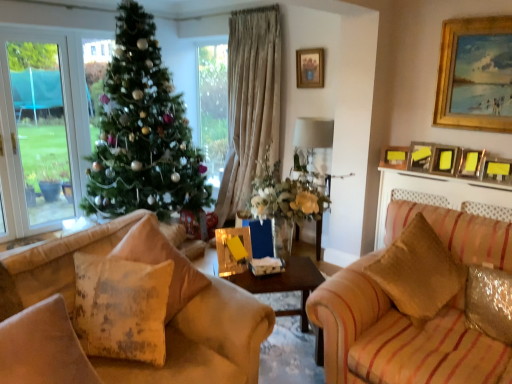
The width and height of the screenshot is (512, 384). I want to click on shiny metallic pillow at lower right, the first pillow from the right, so click(x=489, y=302).

The width and height of the screenshot is (512, 384). Describe the element at coordinates (285, 284) in the screenshot. I see `wooden table at center` at that location.

You are a GUI agent. You are given a task and a screenshot of the screen. Output one action in this format:
    pyautogui.click(x=<x>, y=<y>)
    Task: Click on the wooden table at center
    The width and height of the screenshot is (512, 384).
    Given the screenshot: What is the action you would take?
    pyautogui.click(x=285, y=284)

What do you see at coordinates (310, 68) in the screenshot? The image size is (512, 384). I see `gold-framed picture at upper center, the 7th picture frame in the right-to-left sequence` at bounding box center [310, 68].

This screenshot has width=512, height=384. What do you see at coordinates (162, 261) in the screenshot?
I see `fluffy beige pillow at center, the second pillow when ordered from right to left` at bounding box center [162, 261].

Identify the location of fluffy beige pillow at center, the second pillow when ordered from right to left. The height and width of the screenshot is (384, 512). click(162, 261).

The image size is (512, 384). Identify the location of gold wooden picture frame at upper right, the sixth picture frame positioned from the left. (475, 74).

Considering the positions of point (262, 286) and point (302, 84), is point (262, 286) closer or farther from the camera than point (302, 84)?

Point (262, 286) is positioned closer to the camera compared to point (302, 84).

Considering the sizes of objects wooden table at center and gold-framed picture at upper center, the 1th picture frame from the left, in the image provided, who is shorter, wooden table at center or gold-framed picture at upper center, the 1th picture frame from the left,?

With less height is gold-framed picture at upper center, the 1th picture frame from the left.

From the picture: Is wooden table at center oriented towards gold-framed picture at upper center, the 7th picture frame in the right-to-left sequence?

No, wooden table at center does not turn towards gold-framed picture at upper center, the 7th picture frame in the right-to-left sequence.

At what (x,y) coordinates should I click in order to perform the action: click on table that appears below the gold-framed picture at upper center, the 7th picture frame in the right-to-left sequence (from the image's perspective). Please return your answer as a coordinate pair (x, y). Image resolution: width=512 pixels, height=384 pixels. Looking at the image, I should click on (285, 284).

Between yellow matte picture frame at upper right, which is counted as the fourth picture frame, starting from the left, and metallic gold picture frame at upper right, positioned as the seventh picture frame in left-to-right order, which one is positioned behind?

yellow matte picture frame at upper right, which is counted as the fourth picture frame, starting from the left, is further away from the camera.

Based on their sizes in the image, would you say yellow matte picture frame at upper right, which is the fourth picture frame in right-to-left order, is bigger or smaller than metallic gold picture frame at upper right, positioned as the seventh picture frame in left-to-right order?

In the image, yellow matte picture frame at upper right, which is the fourth picture frame in right-to-left order, appears to be larger than metallic gold picture frame at upper right, positioned as the seventh picture frame in left-to-right order.

Is yellow matte picture frame at upper right, which is counted as the fourth picture frame, starting from the left, at the right side of metallic gold picture frame at upper right, positioned as the first picture frame in right-to-left order?

No.

Which object is thinner, yellow matte picture frame at upper right, which is the fourth picture frame in right-to-left order, or metallic gold picture frame at upper right, positioned as the first picture frame in right-to-left order?

Thinner between the two is metallic gold picture frame at upper right, positioned as the first picture frame in right-to-left order.

From the picture: From a real-world perspective, is metallic gold picture frame at upper right, arranged as the 3th picture frame when viewed from the right, physically below wooden table at center?

No, from a real-world perspective, metallic gold picture frame at upper right, arranged as the 3th picture frame when viewed from the right, is not below wooden table at center.

Between metallic gold picture frame at upper right, arranged as the 3th picture frame when viewed from the right, and wooden table at center, which one has more height?

With more height is wooden table at center.

Which object is positioned more to the left, metallic gold picture frame at upper right, acting as the fifth picture frame starting from the left, or wooden table at center?

wooden table at center is more to the left.

Does point (467, 172) appear closer or farther from the camera than point (274, 274)?

Point (467, 172) appears to be farther away from the viewer than point (274, 274).

Who is bigger, gold wooden picture frame at upper right, which appears as the second picture frame when viewed from the right, or shiny metallic pillow at lower right, the first pillow from the right?

gold wooden picture frame at upper right, which appears as the second picture frame when viewed from the right, is bigger.

Is gold wooden picture frame at upper right, the sixth picture frame positioned from the left, not within shiny metallic pillow at lower right, the first pillow from the right?

That's correct, gold wooden picture frame at upper right, the sixth picture frame positioned from the left, is outside of shiny metallic pillow at lower right, the first pillow from the right.

Which pillow is the 1st one when counting from the front of the gold wooden picture frame at upper right, the sixth picture frame positioned from the left? Please provide its 2D coordinates.

[(489, 302)]

Are gold wooden picture frame at upper right, which appears as the second picture frame when viewed from the right, and shiny metallic pillow at lower right, the first pillow from the right, located far from each other?

Yes, gold wooden picture frame at upper right, which appears as the second picture frame when viewed from the right, and shiny metallic pillow at lower right, the first pillow from the right, are located far from each other.

From a real-world perspective, is gold-framed picture at upper center, the 1th picture frame from the left, located beneath fluffy beige pillow at center, the 3th pillow positioned from the left?

No, from a real-world perspective, gold-framed picture at upper center, the 1th picture frame from the left, is not beneath fluffy beige pillow at center, the 3th pillow positioned from the left.

Considering the relative sizes of gold-framed picture at upper center, the 1th picture frame from the left, and fluffy beige pillow at center, the second pillow when ordered from right to left, in the image provided, is gold-framed picture at upper center, the 1th picture frame from the left, taller than fluffy beige pillow at center, the second pillow when ordered from right to left,?

Incorrect, the height of gold-framed picture at upper center, the 1th picture frame from the left, is not larger of that of fluffy beige pillow at center, the second pillow when ordered from right to left.

Does point (310, 53) come farther from viewer compared to point (136, 233)?

Yes.

Is gold-framed picture at upper center, the 1th picture frame from the left, at the left side of fluffy beige pillow at center, the 3th pillow positioned from the left?

No, gold-framed picture at upper center, the 1th picture frame from the left, is not to the left of fluffy beige pillow at center, the 3th pillow positioned from the left.

From the image's perspective, which is above, metallic gold picture frame at upper right, arranged as the 3th picture frame when viewed from the right, or yellow matte picture frame at upper right, which is counted as the fourth picture frame, starting from the left?

yellow matte picture frame at upper right, which is counted as the fourth picture frame, starting from the left.

Is metallic gold picture frame at upper right, acting as the fifth picture frame starting from the left, closer to the viewer compared to yellow matte picture frame at upper right, which is the fourth picture frame in right-to-left order?

Yes, metallic gold picture frame at upper right, acting as the fifth picture frame starting from the left, is closer to the camera.

Is point (471, 152) positioned behind point (457, 148)?

No, (471, 152) is closer to viewer.

In terms of height, does metallic gold picture frame at upper right, arranged as the 3th picture frame when viewed from the right, look taller or shorter compared to yellow matte picture frame at upper right, which is counted as the fourth picture frame, starting from the left?

Considering their sizes, metallic gold picture frame at upper right, arranged as the 3th picture frame when viewed from the right, has less height than yellow matte picture frame at upper right, which is counted as the fourth picture frame, starting from the left.

Find the location of a particular element. The height and width of the screenshot is (384, 512). pillow that is the 1st object directly below the metallic gold picture frame at upper right, positioned as the seventh picture frame in left-to-right order (from a real-world perspective) is located at coordinates (162, 261).

From the image's perspective, which one is positioned lower, fluffy beige pillow at center, the second pillow when ordered from right to left, or metallic gold picture frame at upper right, positioned as the first picture frame in right-to-left order?

fluffy beige pillow at center, the second pillow when ordered from right to left.

Is fluffy beige pillow at center, the 3th pillow positioned from the left, positioned before metallic gold picture frame at upper right, positioned as the first picture frame in right-to-left order?

Yes, fluffy beige pillow at center, the 3th pillow positioned from the left, is closer to the viewer.

This screenshot has width=512, height=384. In order to click on the 7th picture frame positioned above the wooden table at center (from a real-world perspective) in this screenshot , I will do `click(310, 68)`.

The image size is (512, 384). Find the location of `the 3rd picture frame to the left when counting from the metallic gold picture frame at upper right, positioned as the seventh picture frame in left-to-right order`. the 3rd picture frame to the left when counting from the metallic gold picture frame at upper right, positioned as the seventh picture frame in left-to-right order is located at coordinates (445, 160).

Based on the photo, which object lies nearer to the anchor point metallic gold picture frame at upper right, positioned as the seventh picture frame in left-to-right order, metallic silver picture frame at upper right, marked as the 3th picture frame in a left-to-right arrangement, or distressed yellow pillow at lower left, arranged as the second pillow when viewed from the left?

metallic silver picture frame at upper right, marked as the 3th picture frame in a left-to-right arrangement, is closer to metallic gold picture frame at upper right, positioned as the seventh picture frame in left-to-right order.

Which object lies nearer to the anchor point metallic gold picture frame at upper right, positioned as the seventh picture frame in left-to-right order, metallic silver picture frame at upper right, marked as the 3th picture frame in a left-to-right arrangement, or striped fabric couch at right?

metallic silver picture frame at upper right, marked as the 3th picture frame in a left-to-right arrangement, lies closer to metallic gold picture frame at upper right, positioned as the seventh picture frame in left-to-right order, than the other object.

Which object lies further to the anchor point distressed yellow pillow at lower left, arranged as the second pillow when viewed from the left, wooden table at center or yellow matte picture frame at upper right, which is the fourth picture frame in right-to-left order?

Among the two, yellow matte picture frame at upper right, which is the fourth picture frame in right-to-left order, is located further to distressed yellow pillow at lower left, arranged as the second pillow when viewed from the left.

Which object lies nearer to the anchor point gold wooden picture frame at upper right, which appears as the second picture frame when viewed from the right, wooden table at center or gold-framed picture at upper center, the 7th picture frame in the right-to-left sequence?

gold-framed picture at upper center, the 7th picture frame in the right-to-left sequence, is closer to gold wooden picture frame at upper right, which appears as the second picture frame when viewed from the right.

Which object lies further to the anchor point green matte christmas tree at center, gold wooden picture frame at upper right, the sixth picture frame positioned from the left, or matte gold picture frame at upper right, placed as the sixth picture frame when sorted from right to left?

The object further to green matte christmas tree at center is gold wooden picture frame at upper right, the sixth picture frame positioned from the left.

When comparing their distances from metallic gold picture frame at upper right, positioned as the seventh picture frame in left-to-right order, does striped fabric couch at right or gold-framed picture at upper center, the 7th picture frame in the right-to-left sequence, seem further?

gold-framed picture at upper center, the 7th picture frame in the right-to-left sequence.

From the image, which object appears to be farther from metallic gold picture frame at upper right, acting as the fifth picture frame starting from the left, striped fabric couch at right or fluffy beige pillow at center, the second pillow when ordered from right to left?

Based on the image, fluffy beige pillow at center, the second pillow when ordered from right to left, appears to be further to metallic gold picture frame at upper right, acting as the fifth picture frame starting from the left.

Based on their spatial positions, is gold-framed picture at upper center, the 1th picture frame from the left, or green matte christmas tree at center closer to distressed yellow pillow at lower left, which is the third pillow from right to left?

Based on the image, green matte christmas tree at center appears to be nearer to distressed yellow pillow at lower left, which is the third pillow from right to left.

Where is `studio couch located between shiny metallic pillow at lower right, the first pillow from the right, and metallic gold picture frame at upper right, positioned as the seventh picture frame in left-to-right order, in the depth direction`? The width and height of the screenshot is (512, 384). studio couch located between shiny metallic pillow at lower right, the first pillow from the right, and metallic gold picture frame at upper right, positioned as the seventh picture frame in left-to-right order, in the depth direction is located at coordinates (395, 337).

Where is `studio couch located between fluffy beige pillow at center, the second pillow when ordered from right to left, and shiny metallic pillow at lower right, the fourth pillow when ordered from left to right, in the left-right direction`? The image size is (512, 384). studio couch located between fluffy beige pillow at center, the second pillow when ordered from right to left, and shiny metallic pillow at lower right, the fourth pillow when ordered from left to right, in the left-right direction is located at coordinates [x=395, y=337].

Identify the location of studio couch situated between green matte christmas tree at center and metallic gold picture frame at upper right, arranged as the 3th picture frame when viewed from the right, from left to right. (395, 337).

The image size is (512, 384). What are the coordinates of `studio couch between distressed fabric pillow at lower left, positioned as the fourth pillow in right-to-left order, and gold wooden picture frame at upper right, which appears as the second picture frame when viewed from the right, in the horizontal direction` in the screenshot? It's located at (395, 337).